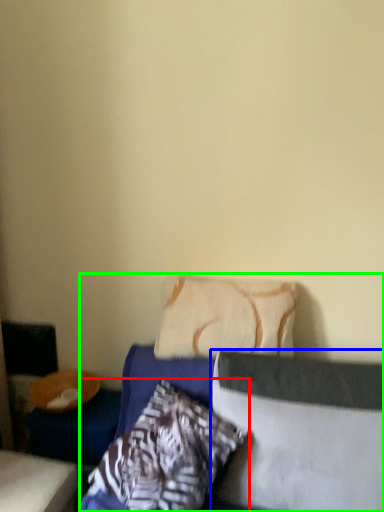
Question: Which object is the closest to the pillow (highlighted by a red box)? Choose among these: pillow (highlighted by a blue box) or bed (highlighted by a green box).

Choices:
 (A) pillow
 (B) bed

Answer: (B)